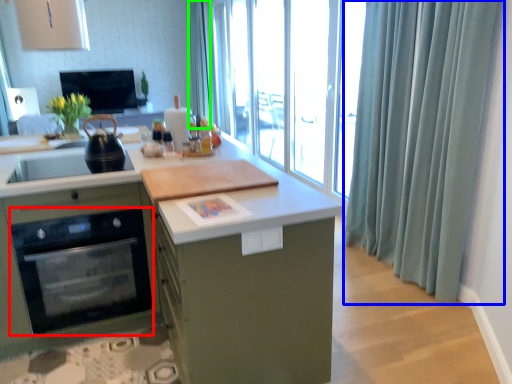
Question: Which is farther away from home appliance (highlighted by a red box)? shower curtain (highlighted by a blue box) or shower curtain (highlighted by a green box)?

Choices:
 (A) shower curtain
 (B) shower curtain

Answer: (B)